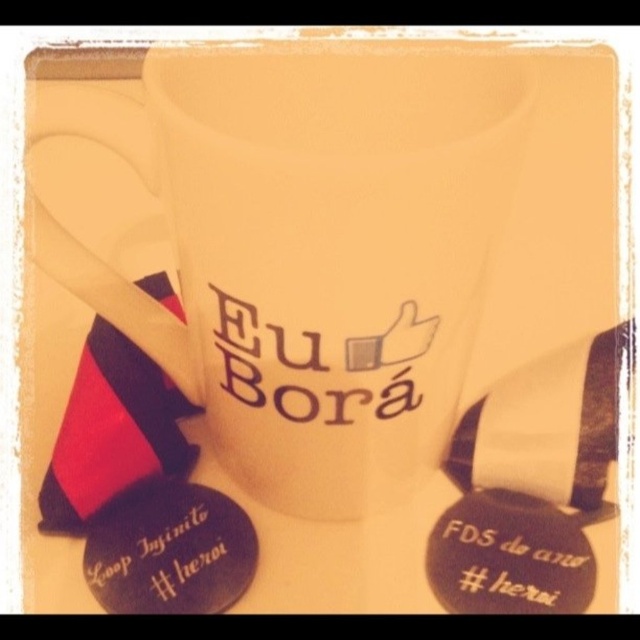
Question: Is white matte mug at center positioned in front of black matte badge at lower right?

Choices:
 (A) no
 (B) yes

Answer: (B)

Question: Which point is farther from the camera taking this photo?

Choices:
 (A) [x=124, y=550]
 (B) [x=477, y=612]
 (C) [x=284, y=65]

Answer: (A)

Question: Which point is farther from the camera taking this photo?

Choices:
 (A) (556, 538)
 (B) (275, 426)
 (C) (209, 548)

Answer: (A)

Question: From the image, what is the correct spatial relationship of white matte mug at center in relation to black matte badge at lower left?

Choices:
 (A) left
 (B) right

Answer: (B)

Question: Observing the image, what is the correct spatial positioning of black matte badge at lower left in reference to black matte badge at lower right?

Choices:
 (A) above
 (B) below

Answer: (A)

Question: Based on their relative distances, which object is farther from the white matte mug at center?

Choices:
 (A) black matte badge at lower right
 (B) black matte badge at lower left

Answer: (A)